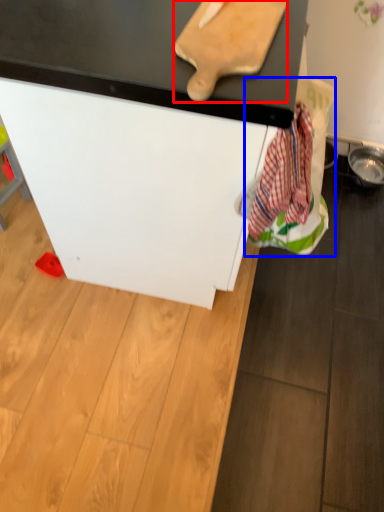
Question: Which object appears closest to the camera in this image, cutting board (highlighted by a red box) or laundry (highlighted by a blue box)?

Choices:
 (A) cutting board
 (B) laundry

Answer: (A)